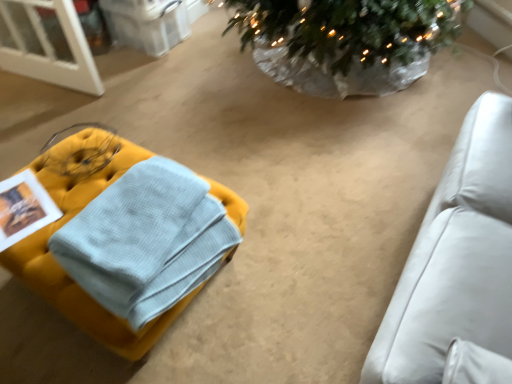
Find the location of `yellow velvet ottoman at left`. yellow velvet ottoman at left is located at coordinates (67, 275).

The image size is (512, 384). What do you see at coordinates (67, 275) in the screenshot?
I see `yellow velvet ottoman at left` at bounding box center [67, 275].

What is the approximate width of yellow velvet ottoman at left?

It is 49.97 centimeters.

Identify the location of yellow velvet ottoman at left. (67, 275).